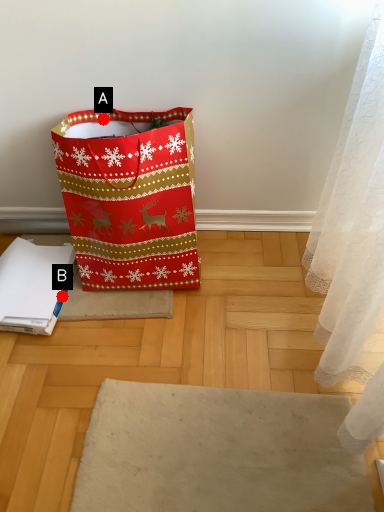
Question: Two points are circled on the image, labeled by A and B beside each circle. Which point is closer to the camera?

Choices:
 (A) A is closer
 (B) B is closer

Answer: (A)